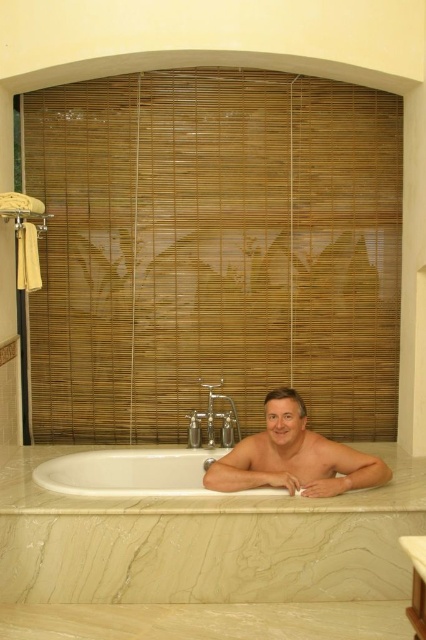
Who is taller, smooth skin man at center or white glossy bathtub at lower left?

With more height is smooth skin man at center.

Which is above, smooth skin man at center or white glossy bathtub at lower left?

smooth skin man at center

Who is more forward, (385, 481) or (160, 472)?

Point (385, 481) is in front.

The width and height of the screenshot is (426, 640). In order to click on smooth skin man at center in this screenshot , I will do `click(293, 456)`.

Can you confirm if white marble bathtub at center is thinner than smooth skin man at center?

In fact, white marble bathtub at center might be wider than smooth skin man at center.

Between white marble bathtub at center and smooth skin man at center, which one is positioned lower?

white marble bathtub at center

Looking at this image, who is more forward, (x=367, y=554) or (x=253, y=435)?

Positioned in front is point (x=367, y=554).

Identify the location of white marble bathtub at center. Image resolution: width=426 pixels, height=640 pixels. (207, 541).

Between point (155, 525) and point (161, 472), which one is positioned in front?

Point (155, 525) is more forward.

Can you confirm if white marble bathtub at center is bigger than white glossy bathtub at lower left?

Yes.

Is point (46, 561) more distant than point (75, 454)?

That is False.

Identify the location of white marble bathtub at center. The image size is (426, 640). (207, 541).